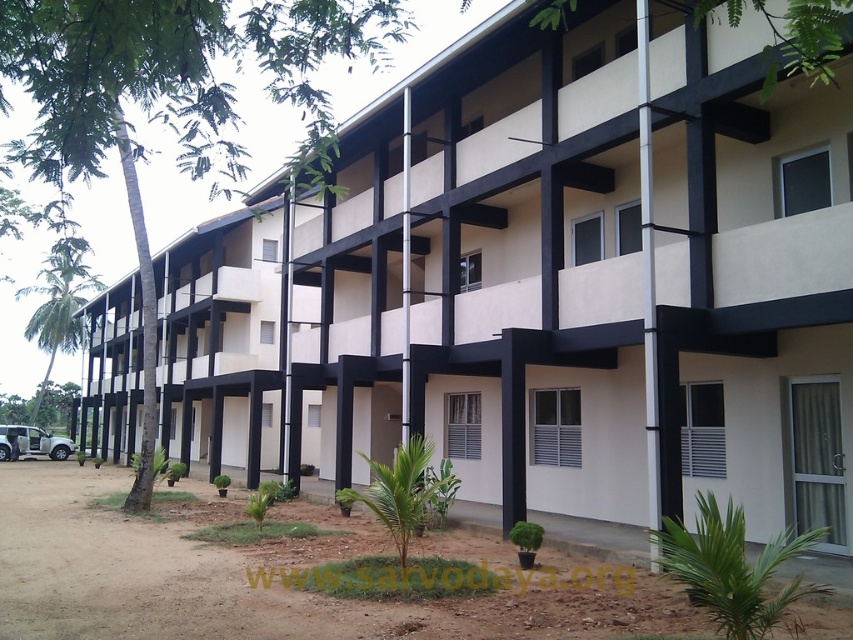
Question: Is green leafy tree at left below green leafy palm tree at left?

Choices:
 (A) yes
 (B) no

Answer: (B)

Question: Observing the image, what is the correct spatial positioning of green leafy tree at left in reference to green leafy palm tree at left?

Choices:
 (A) below
 (B) above

Answer: (B)

Question: Which of the following is the closest to the observer?

Choices:
 (A) green leafy palm tree at left
 (B) green leafy tree at left

Answer: (B)

Question: Which object is closer to the camera taking this photo?

Choices:
 (A) green leafy tree at left
 (B) green leafy palm tree at left

Answer: (A)

Question: Which object appears closest to the camera in this image?

Choices:
 (A) green leafy palm tree at left
 (B) green leafy tree at left

Answer: (B)

Question: Can you confirm if green leafy tree at left is positioned above green leafy palm tree at left?

Choices:
 (A) yes
 (B) no

Answer: (A)